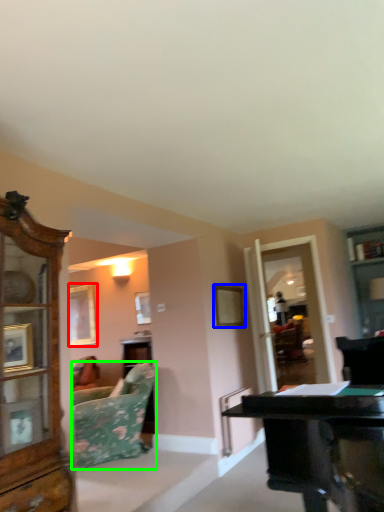
Question: Considering the real-world distances, which object is farthest from picture frame (highlighted by a red box)? picture frame (highlighted by a blue box) or studio couch (highlighted by a green box)?

Choices:
 (A) picture frame
 (B) studio couch

Answer: (A)